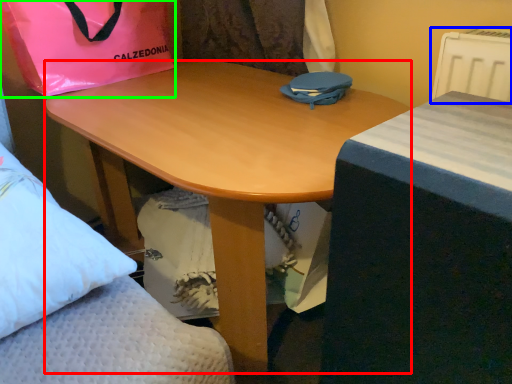
Question: Which is nearer to the desk (highlighted by a red box)? radiator (highlighted by a blue box) or bag (highlighted by a green box).

Choices:
 (A) radiator
 (B) bag

Answer: (B)